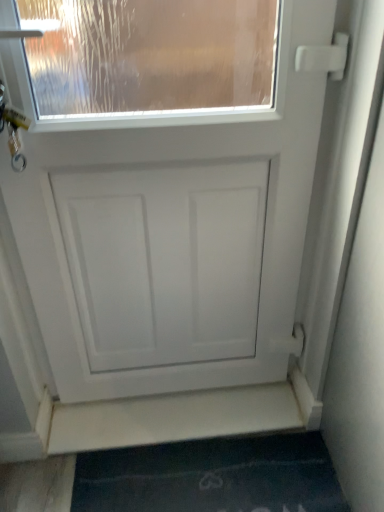
Question: From the image's perspective, is dark blue carpet at lower center located above or below white matte door at center?

Choices:
 (A) below
 (B) above

Answer: (A)

Question: Do you think dark blue carpet at lower center is within white matte door at center, or outside of it?

Choices:
 (A) inside
 (B) outside

Answer: (B)

Question: Which object is positioned farthest from the dark blue carpet at lower center?

Choices:
 (A) white matte door at center
 (B) white matte stairwell at lower center

Answer: (A)

Question: Which object is positioned farthest from the dark blue carpet at lower center?

Choices:
 (A) white matte door at center
 (B) white matte stairwell at lower center

Answer: (A)